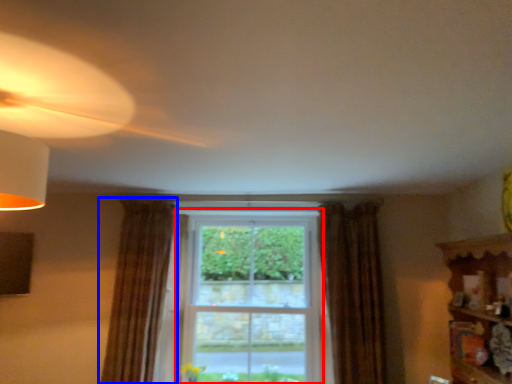
Question: Which object appears closest to the camera in this image, bay window (highlighted by a red box) or curtain (highlighted by a blue box)?

Choices:
 (A) bay window
 (B) curtain

Answer: (B)